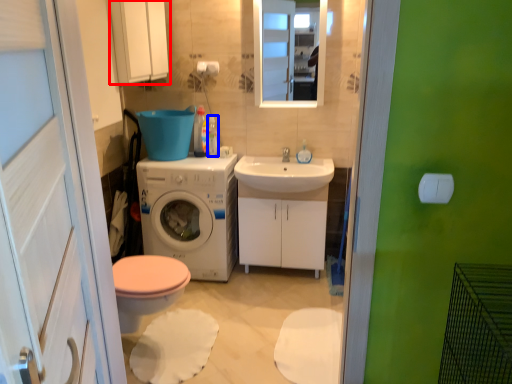
Question: Which object is further to the camera taking this photo, medicine cabinet (highlighted by a red box) or toiletry (highlighted by a blue box)?

Choices:
 (A) medicine cabinet
 (B) toiletry

Answer: (B)